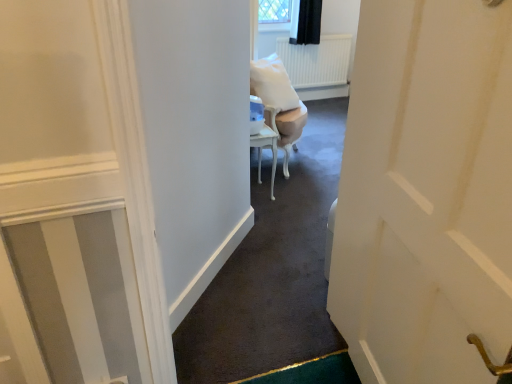
Question: Is white glossy chair at center surrounded by white glossy table at center?

Choices:
 (A) yes
 (B) no

Answer: (B)

Question: Is white glossy table at center to the left of white glossy chair at center from the viewer's perspective?

Choices:
 (A) yes
 (B) no

Answer: (A)

Question: Does white glossy table at center appear on the right side of white glossy chair at center?

Choices:
 (A) no
 (B) yes

Answer: (A)

Question: From the image's perspective, is white glossy table at center located beneath white glossy chair at center?

Choices:
 (A) no
 (B) yes

Answer: (B)

Question: Is white glossy table at center located outside white glossy chair at center?

Choices:
 (A) no
 (B) yes

Answer: (B)

Question: From the image's perspective, is white glossy table at center over white glossy chair at center?

Choices:
 (A) no
 (B) yes

Answer: (A)

Question: Is white glossy chair at center shorter than white glossy table at center?

Choices:
 (A) yes
 (B) no

Answer: (B)

Question: From a real-world perspective, is white glossy chair at center physically above white glossy table at center?

Choices:
 (A) yes
 (B) no

Answer: (A)

Question: Does white glossy chair at center have a greater width compared to white glossy table at center?

Choices:
 (A) yes
 (B) no

Answer: (A)

Question: Is white glossy chair at center turned away from white glossy table at center?

Choices:
 (A) no
 (B) yes

Answer: (A)

Question: Can you confirm if white glossy chair at center is thinner than white glossy table at center?

Choices:
 (A) no
 (B) yes

Answer: (A)

Question: Are white glossy chair at center and white glossy table at center located far from each other?

Choices:
 (A) yes
 (B) no

Answer: (B)

Question: Is white glossy chair at center in front of or behind white glossy table at center in the image?

Choices:
 (A) front
 (B) behind

Answer: (B)